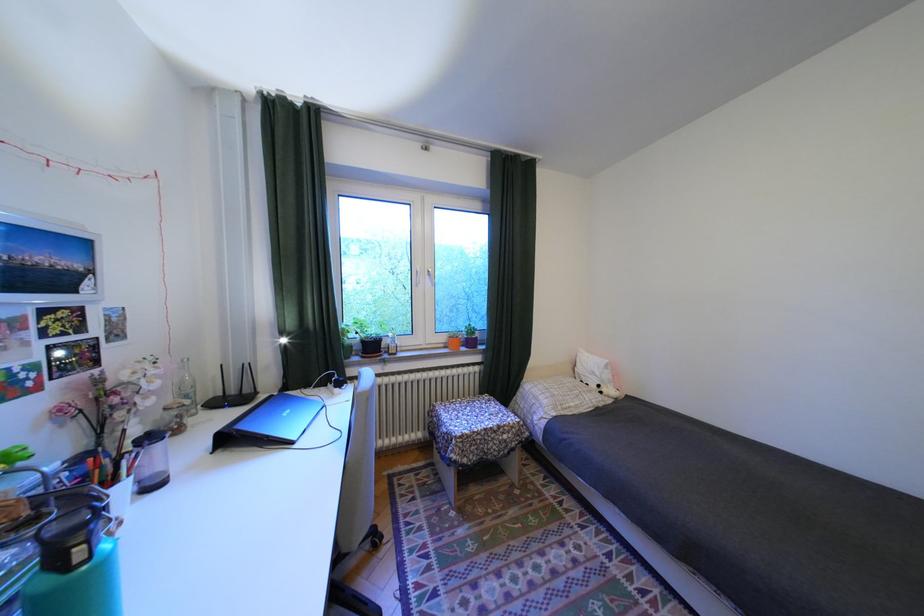
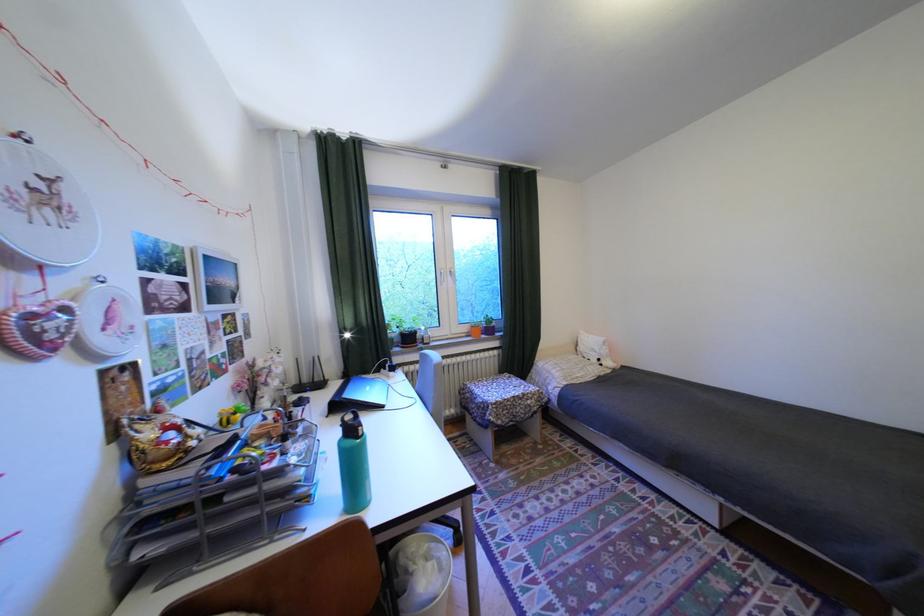
The images are taken continuously from a first-person perspective. In which direction are you moving?

The cameraman moved toward left, backward.